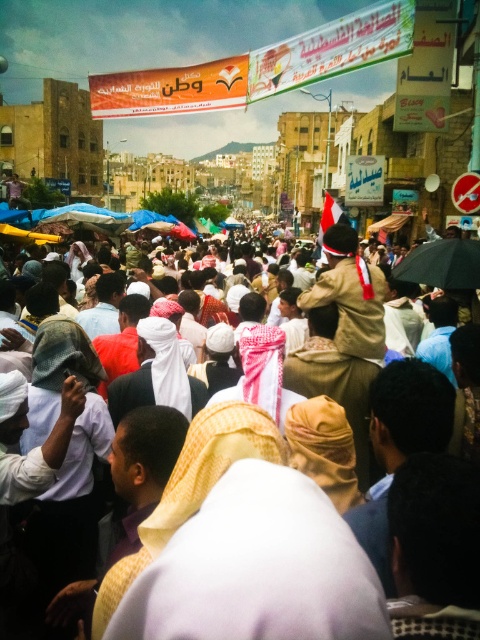
Question: Which object is closer to the camera taking this photo?

Choices:
 (A) white cloth at center
 (B) black matte umbrella at center

Answer: (A)

Question: Which of the following is the farthest from the observer?

Choices:
 (A) black matte umbrella at center
 (B) white cloth at center

Answer: (A)

Question: Does white cloth at center lie in front of black matte umbrella at center?

Choices:
 (A) no
 (B) yes

Answer: (B)

Question: Does white cloth at center have a larger size compared to black matte umbrella at center?

Choices:
 (A) no
 (B) yes

Answer: (B)

Question: Does white cloth at center have a smaller size compared to black matte umbrella at center?

Choices:
 (A) yes
 (B) no

Answer: (B)